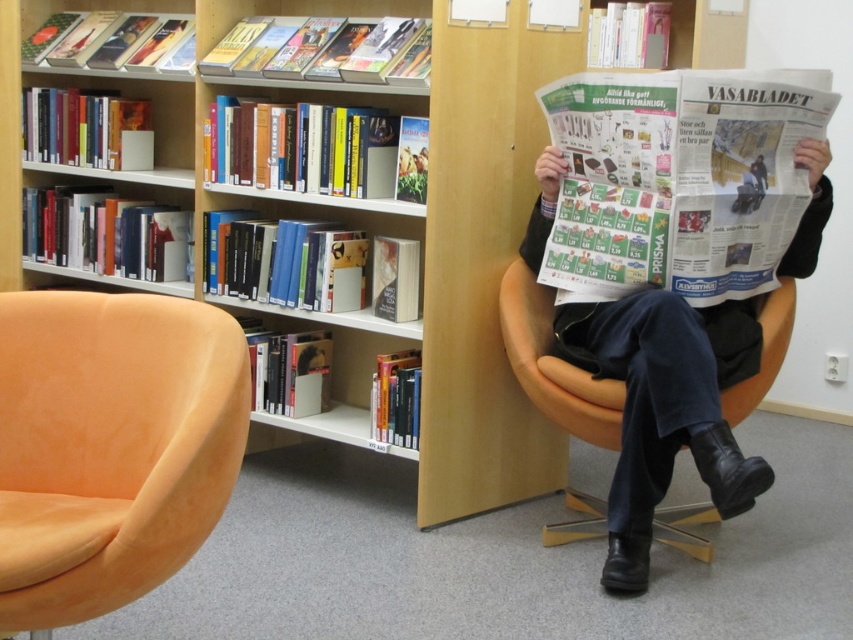
Can you confirm if wooden bookshelf at upper center is taller than orange fabric armchair at center?

Indeed, wooden bookshelf at upper center has a greater height compared to orange fabric armchair at center.

Can you confirm if wooden bookshelf at upper center is positioned to the right of orange fabric armchair at center?

No, wooden bookshelf at upper center is not to the right of orange fabric armchair at center.

What do you see at coordinates (361, 220) in the screenshot? This screenshot has width=853, height=640. I see `wooden bookshelf at upper center` at bounding box center [361, 220].

Where is `wooden bookshelf at upper center`? This screenshot has height=640, width=853. wooden bookshelf at upper center is located at coordinates (361, 220).

Does wooden bookshelf at upper center have a greater width compared to suede orange swivel chair at left?

Yes.

Is point (93, 280) farther from camera compared to point (105, 477)?

Yes, it is behind point (105, 477).

Where is `wooden bookshelf at upper center`? Image resolution: width=853 pixels, height=640 pixels. wooden bookshelf at upper center is located at coordinates (361, 220).

You are a GUI agent. You are given a task and a screenshot of the screen. Output one action in this format:
    pyautogui.click(x=<x>, y=<y>)
    Task: Click on the wooden bookshelf at upper center
    The width and height of the screenshot is (853, 640).
    Given the screenshot: What is the action you would take?
    pyautogui.click(x=361, y=220)

Between suede orange swivel chair at left and orange fabric armchair at center, which one is positioned higher?

Positioned higher is orange fabric armchair at center.

Between point (97, 531) and point (578, 525), which one is positioned in front?

Point (97, 531) is in front.

Where is `suede orange swivel chair at left`? Image resolution: width=853 pixels, height=640 pixels. suede orange swivel chair at left is located at coordinates (109, 445).